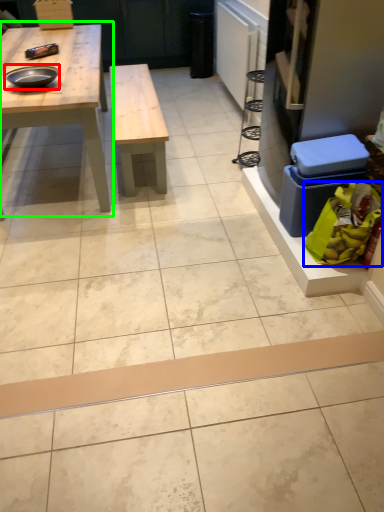
Question: Which object is the closest to the tray (highlighted by a red box)? Choose among these: food (highlighted by a blue box) or table (highlighted by a green box).

Choices:
 (A) food
 (B) table

Answer: (B)